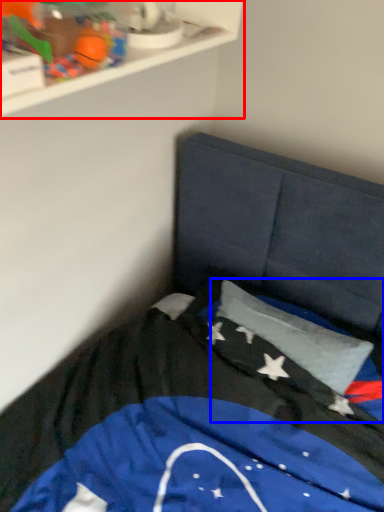
Question: Among these objects, which one is nearest to the camera, shelf (highlighted by a red box) or flag (highlighted by a blue box)?

Choices:
 (A) shelf
 (B) flag

Answer: (A)